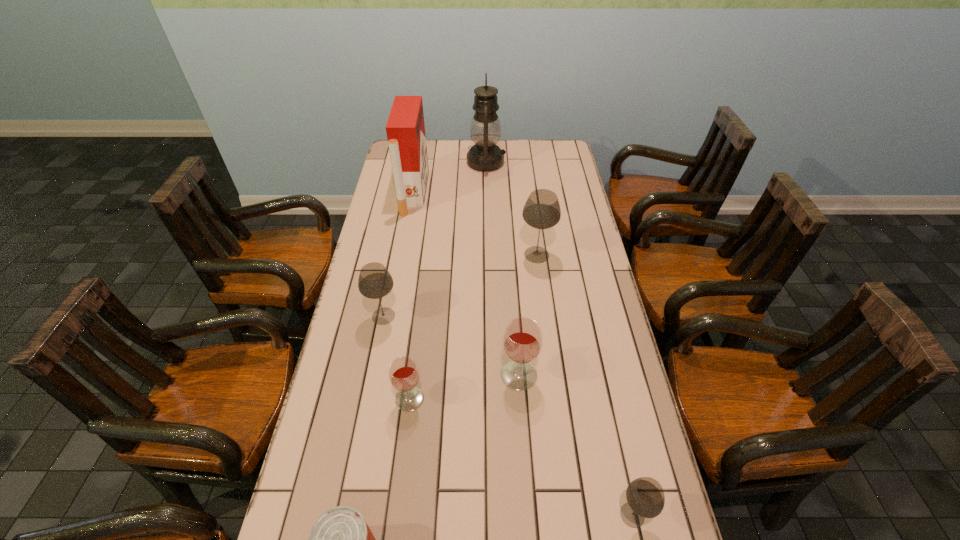
Locate an element on the screen. This screenshot has height=540, width=960. cigarette case situated at the left edge is located at coordinates (405, 128).

What are the coordinates of `wineglass that is at the left edge` in the screenshot? It's located at (374, 282).

Locate an element on the screen. This screenshot has height=540, width=960. free space at the left edge of the desktop is located at coordinates (355, 389).

In the image, there is a desktop. Identify the location of vacant space at the right edge. This screenshot has width=960, height=540. (598, 467).

In the image, there is a desktop. Identify the location of vacant space at the far right corner. (538, 165).

Locate an element on the screen. empty space between the smallest gray wineglass and the oil lamp is located at coordinates (560, 339).

Identify the location of free space between the oil lamp and the second farthest wineglass. (435, 239).

You are a GUI agent. You are given a task and a screenshot of the screen. Output one action in this format:
    pyautogui.click(x=<x>, y=<y>)
    Task: Click on the free space between the leftmost gray wineglass and the seventh shortest object
    Image resolution: width=960 pixels, height=540 pixels.
    Given the screenshot: What is the action you would take?
    pyautogui.click(x=398, y=254)

The height and width of the screenshot is (540, 960). I want to click on unoccupied area between the oil lamp and the second wineglass from left to right, so click(448, 280).

You are a GUI agent. You are given a task and a screenshot of the screen. Output one action in this format:
    pyautogui.click(x=<x>, y=<y>)
    Task: Click on the free spot between the bigger red wineglass and the rightmost object
    The height and width of the screenshot is (540, 960).
    Given the screenshot: What is the action you would take?
    pyautogui.click(x=575, y=445)